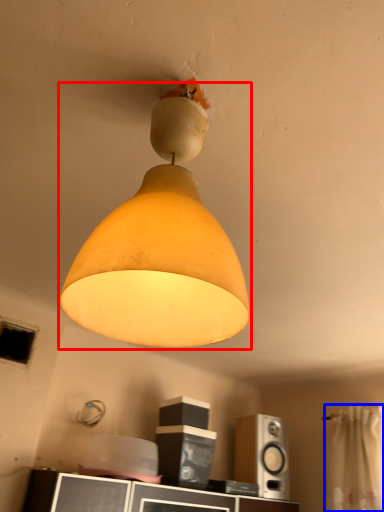
Question: Which object appears farthest to the camera in this image, lamp (highlighted by a red box) or curtain (highlighted by a blue box)?

Choices:
 (A) lamp
 (B) curtain

Answer: (B)